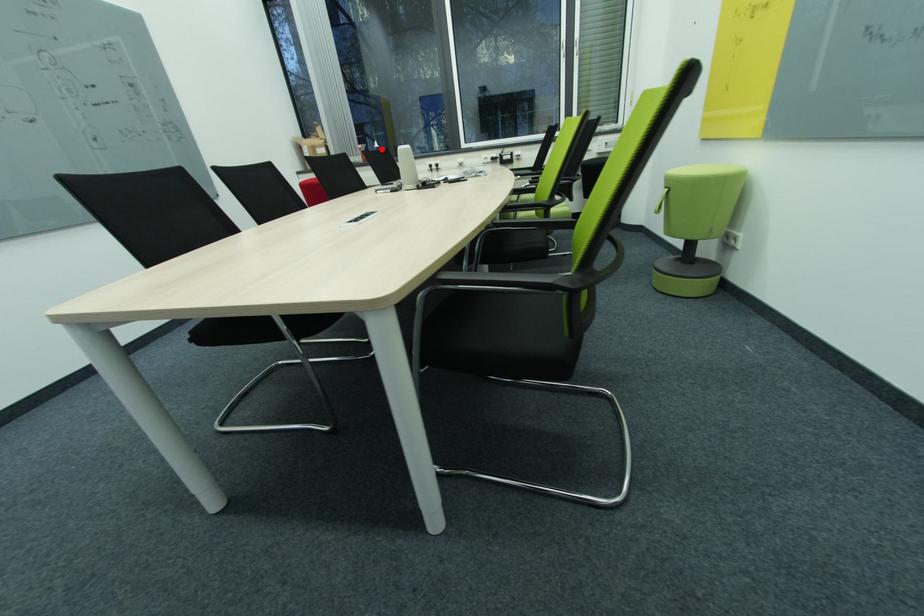
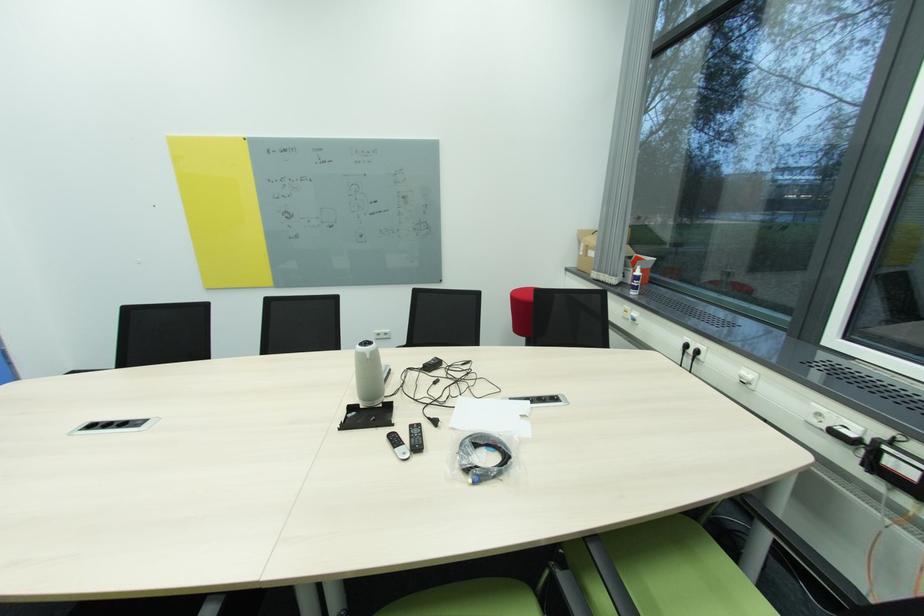
Question: I am providing you with two images of the same scene from different viewpoints. In image1, a red point is highlighted. Considering the same 3D point in image2, which of the following is correct?

Choices:
 (A) It is closer
 (B) It is farther

Answer: (B)